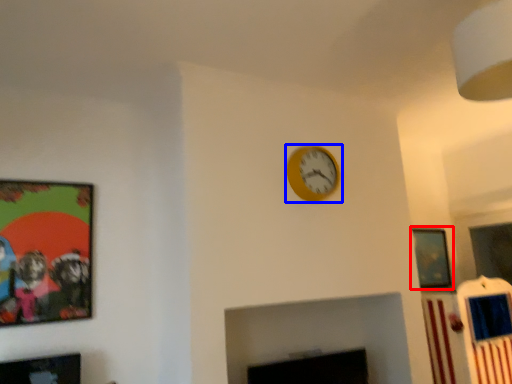
Question: Which point is further to the camera, picture frame (highlighted by a red box) or wall clock (highlighted by a blue box)?

Choices:
 (A) picture frame
 (B) wall clock

Answer: (A)